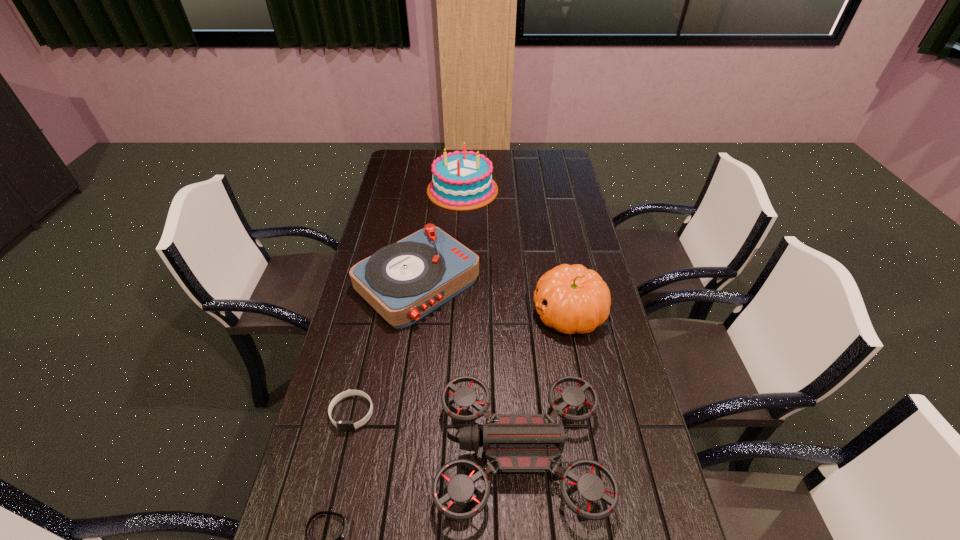
I want to click on birthday cake, so click(461, 181).

You are a GUI agent. You are given a task and a screenshot of the screen. Output one action in this format:
    pyautogui.click(x=<x>, y=<y>)
    Task: Click on the pumpkin
    This screenshot has height=540, width=960.
    Given the screenshot: What is the action you would take?
    pyautogui.click(x=572, y=299)

Find the location of a particular element. The width and height of the screenshot is (960, 540). record player is located at coordinates (404, 281).

Identify the location of drone. This screenshot has width=960, height=540. (515, 442).

The image size is (960, 540). What are the coordinates of `the taller wristband` in the screenshot? It's located at (343, 426).

At what (x,y) coordinates should I click in order to perform the action: click on the farther wristband. Please return your answer as a coordinate pair (x, y). The image size is (960, 540). Looking at the image, I should click on (343, 426).

Image resolution: width=960 pixels, height=540 pixels. I want to click on vacant region located 0.250m on the right of the birthday cake, so pos(556,190).

The height and width of the screenshot is (540, 960). I want to click on free space located on the carved face of the fifth shortest object, so click(434, 313).

Identify the location of vacant region located on the carved face of the fifth shortest object. The image size is (960, 540). (503, 313).

Locate an element on the screen. free region located on the carved face of the fifth shortest object is located at coordinates (418, 313).